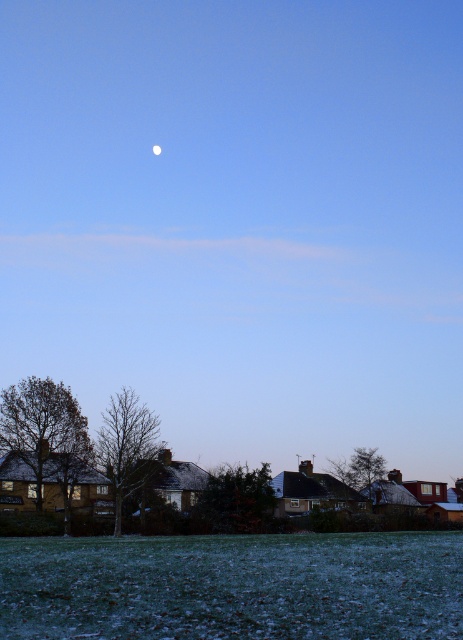
You are a landscape designer planning to plant a new tree in the suburban area. You have two options based on the image provided. Which tree, the brown leafless tree at lower left or the green leafy tree at center, would you recommend for a space where you want the tree to take up more area?

The green leafy tree at center occupies more space than the brown leafless tree at lower left, so it would be the better choice for a space where the tree needs to take up more area.

You are standing at point (233, 586) in the suburban scene. What do you see directly below you?

You see green frosty grass at lower center directly below the point (233, 586).